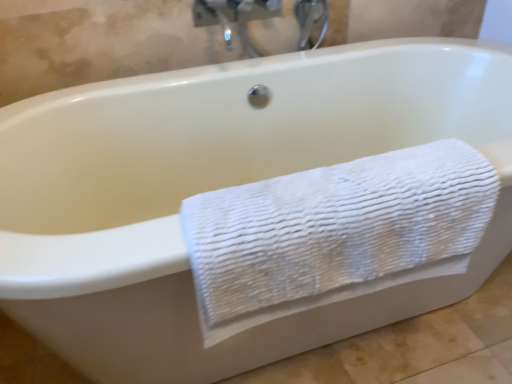
Question: From the image's perspective, is matte silver faucet at upper center above or below white textured towel at lower right?

Choices:
 (A) above
 (B) below

Answer: (A)

Question: Considering the positions of matte silver faucet at upper center and white textured towel at lower right in the image, is matte silver faucet at upper center bigger or smaller than white textured towel at lower right?

Choices:
 (A) small
 (B) big

Answer: (A)

Question: Relative to white textured towel at lower right, is matte silver faucet at upper center in front or behind?

Choices:
 (A) behind
 (B) front

Answer: (A)

Question: Is point (193, 213) positioned closer to the camera than point (321, 4)?

Choices:
 (A) closer
 (B) farther

Answer: (A)

Question: Is white textured towel at lower right inside the boundaries of matte silver faucet at upper center, or outside?

Choices:
 (A) outside
 (B) inside

Answer: (A)

Question: In terms of size, does white textured towel at lower right appear bigger or smaller than matte silver faucet at upper center?

Choices:
 (A) big
 (B) small

Answer: (A)

Question: In the image, is white textured towel at lower right on the left side or the right side of matte silver faucet at upper center?

Choices:
 (A) right
 (B) left

Answer: (B)